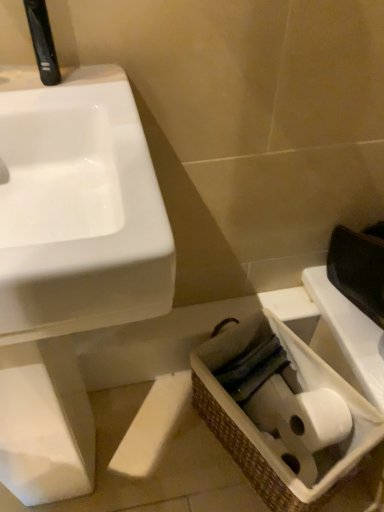
Find the location of a particular element. This screenshot has height=512, width=384. vacant area that is situated to the right of black plastic faucet at upper left is located at coordinates (105, 88).